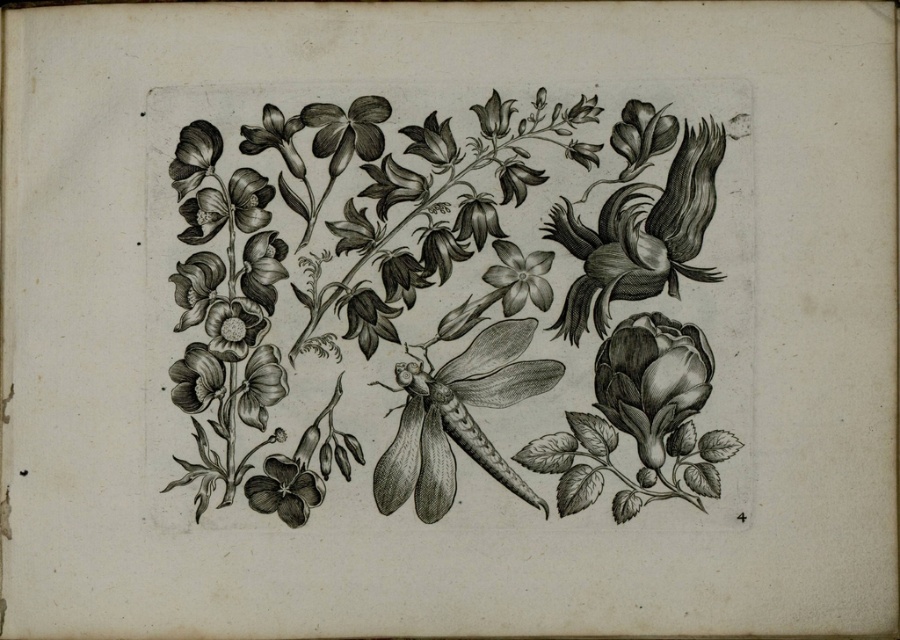
Question: Can you confirm if smooth black flower at bottom left is wider than smooth paper flower at center?

Choices:
 (A) yes
 (B) no

Answer: (A)

Question: Observing the image, what is the correct spatial positioning of etched floral arrangement at center in reference to smooth paper flower at center?

Choices:
 (A) left
 (B) right

Answer: (A)

Question: Which of these objects is positioned farthest from the smooth black rose at right?

Choices:
 (A) smooth black dragonfly at center
 (B) smooth black flower at bottom left

Answer: (B)

Question: Which object is the closest to the smooth black dragonfly at center?

Choices:
 (A) smooth black rose at right
 (B) smooth black flower at bottom left

Answer: (A)

Question: Is smooth black rose at right positioned behind smooth black flower at bottom left?

Choices:
 (A) yes
 (B) no

Answer: (B)

Question: Estimate the real-world distances between objects in this image. Which object is farther from the smooth paper flower at center?

Choices:
 (A) smooth black dragonfly at center
 (B) smooth black flower at bottom left

Answer: (B)